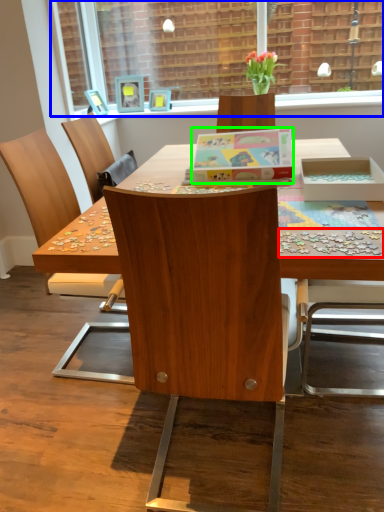
Question: Which object is the farthest from jigsaw puzzle (highlighted by a red box)? Choose among these: window screen (highlighted by a blue box) or box (highlighted by a green box).

Choices:
 (A) window screen
 (B) box

Answer: (A)